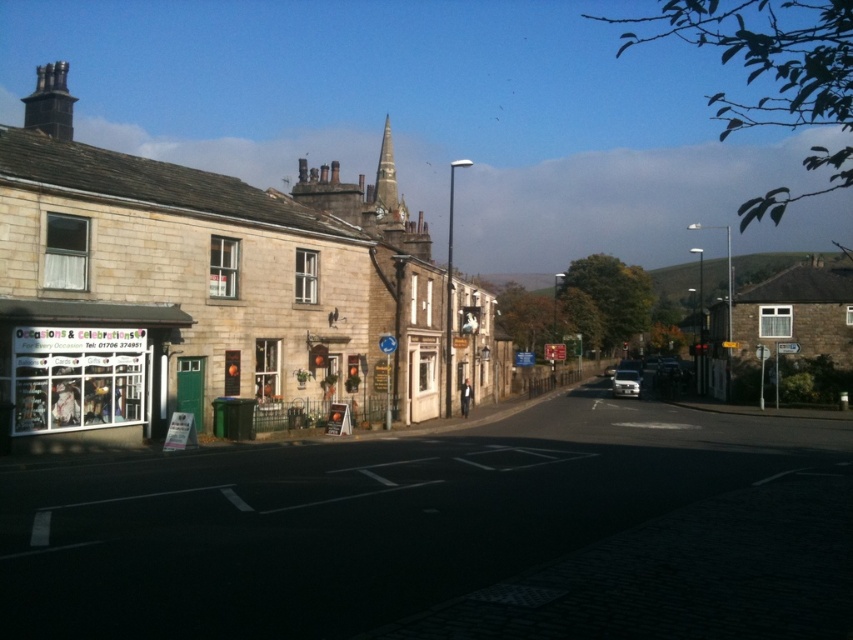
Question: Is stone building at left thinner than smooth stone spire at center?

Choices:
 (A) no
 (B) yes

Answer: (A)

Question: Which object is positioned farthest from the stone building at left?

Choices:
 (A) smooth stone spire at center
 (B) matte glass window at left
 (C) white glossy car at center-right

Answer: (C)

Question: Can you confirm if matte glass window at left is bigger than smooth stone spire at center?

Choices:
 (A) no
 (B) yes

Answer: (A)

Question: Which object is farther from the camera taking this photo?

Choices:
 (A) matte glass window at left
 (B) white glossy car at center-right
 (C) stone building at left

Answer: (B)

Question: Which point appears farthest from the camera in this image?

Choices:
 (A) (378, 186)
 (B) (77, 419)
 (C) (633, 394)

Answer: (A)

Question: Is stone building at left further to camera compared to white glossy car at center-right?

Choices:
 (A) yes
 (B) no

Answer: (B)